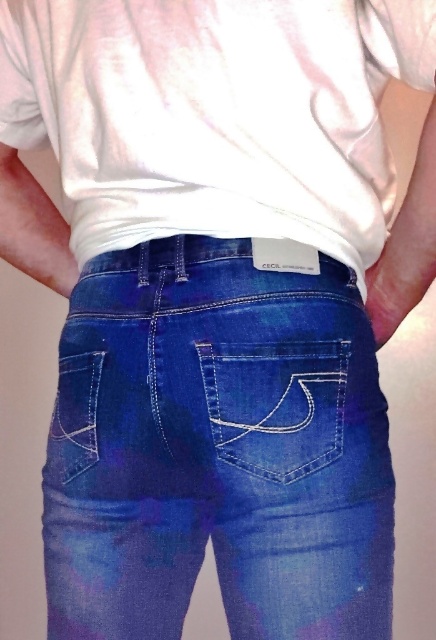
Who is higher up, white matte t-shirt at center or denim pocket at lower left?

Positioned higher is white matte t-shirt at center.

Is white matte t-shirt at center positioned before denim pocket at lower left?

That is True.

Does point (276, 179) come closer to viewer compared to point (82, 442)?

Yes, it is in front of point (82, 442).

I want to click on white matte t-shirt at center, so click(x=214, y=113).

Who is shorter, white matte t-shirt at center or denim pocket at center?

With less height is denim pocket at center.

Find the location of a particular element. Image resolution: width=436 pixels, height=640 pixels. white matte t-shirt at center is located at coordinates (214, 113).

Is point (77, 173) behind point (289, 356)?

Yes, point (77, 173) is farther from viewer.

The height and width of the screenshot is (640, 436). What are the coordinates of `white matte t-shirt at center` in the screenshot? It's located at (214, 113).

Is denim pocket at center taller than denim pocket at lower left?

No, denim pocket at center is not taller than denim pocket at lower left.

Is denim pocket at center behind denim pocket at lower left?

No, it is not.

Who is more forward, (322, 342) or (87, 428)?

Point (322, 342) is more forward.

You are a GUI agent. You are given a task and a screenshot of the screen. Output one action in this format:
    pyautogui.click(x=<x>, y=<y>)
    Task: Click on the denim pocket at center
    The image size is (436, 640).
    Given the screenshot: What is the action you would take?
    pyautogui.click(x=275, y=404)